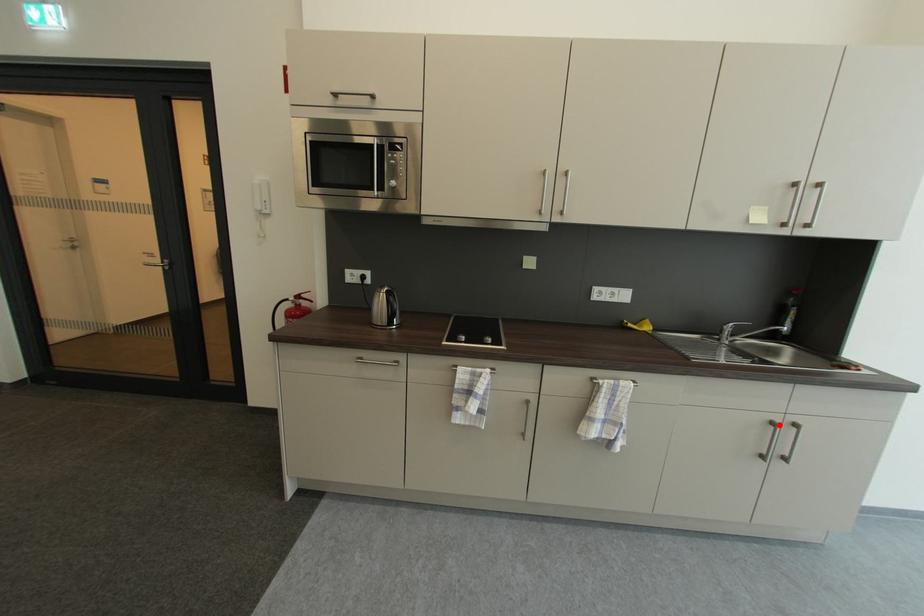
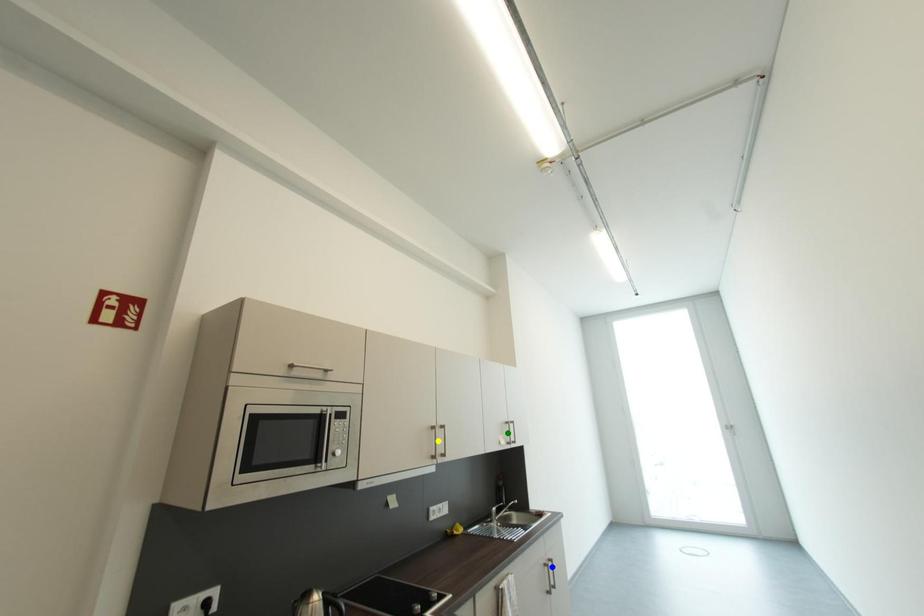
Question: I am providing you with two images of the same scene from different viewpoints. A red point is marked on the first image. You are given multiple points on the second image. In image 2, which mark is for the same physical point as the one in image 1?

Choices:
 (A) yellow point
 (B) blue point
 (C) green point

Answer: (B)